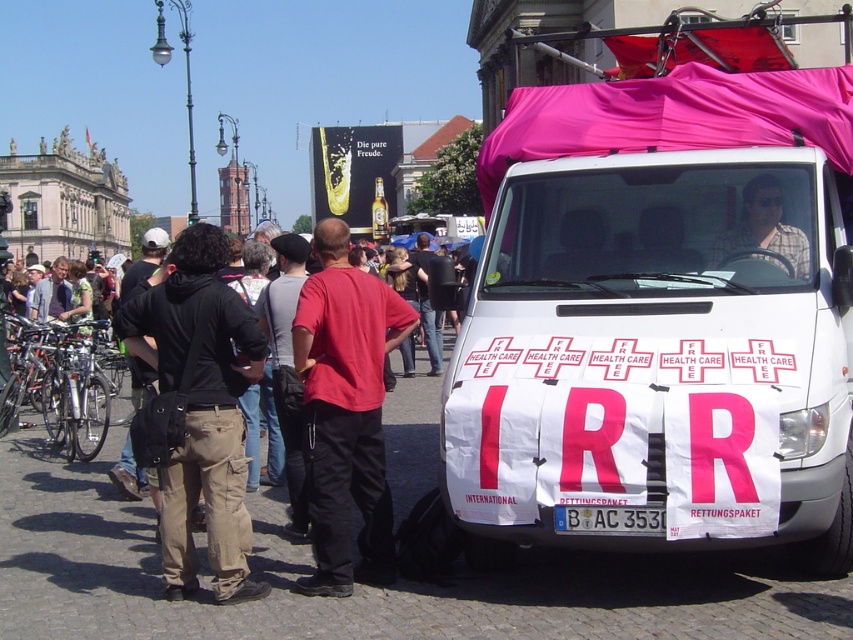
Based on the photo, you are a photographer trying to capture both the white fabric van at right and the red cotton shirt at center in a single shot. Based on their positions, which object should you position closer to the left side of your camera frame to include both?

Since the white fabric van at right is to the right of the red cotton shirt at center, you should position the red cotton shirt at center closer to the left side of your camera frame to include both in the shot.